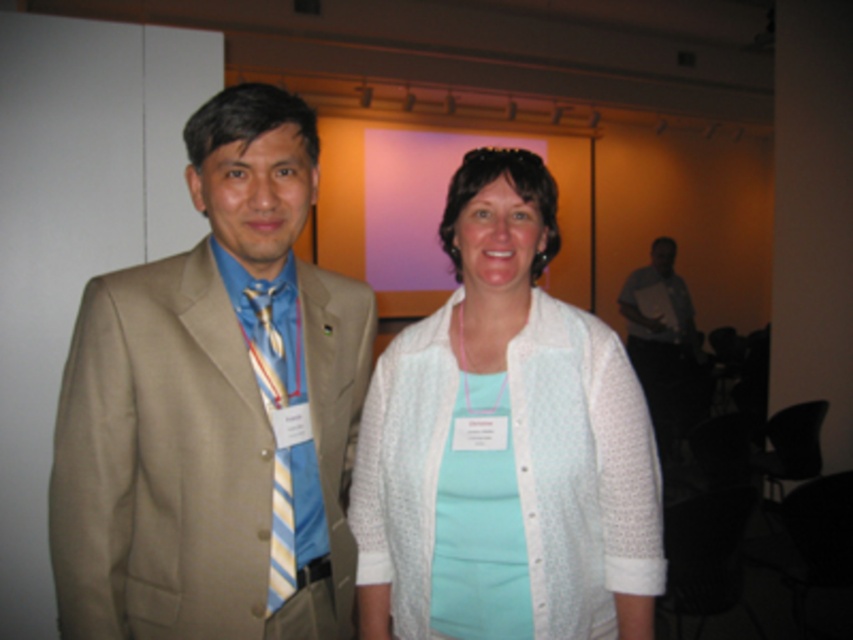
Question: Observing the image, what is the correct spatial positioning of white textured cardigan at center in reference to matte white neck at center?

Choices:
 (A) left
 (B) right

Answer: (B)

Question: Is dark gray shirt at right positioned at the back of matte blue tie at center?

Choices:
 (A) yes
 (B) no

Answer: (A)

Question: Considering the real-world distances, which object is farthest from the striped silk tie at center?

Choices:
 (A) matte blue tie at center
 (B) tan fabric suit at left
 (C) matte white neck at center
 (D) white textured cardigan at center

Answer: (C)

Question: Is tan fabric suit at left positioned at the back of matte blue tie at center?

Choices:
 (A) yes
 (B) no

Answer: (B)

Question: Based on their relative distances, which object is farther from the striped silk tie at center?

Choices:
 (A) matte blue tie at center
 (B) dark gray shirt at right
 (C) matte white neck at center

Answer: (B)

Question: Which point is farther from the camera taking this photo?

Choices:
 (A) (184, 417)
 (B) (474, 314)

Answer: (B)